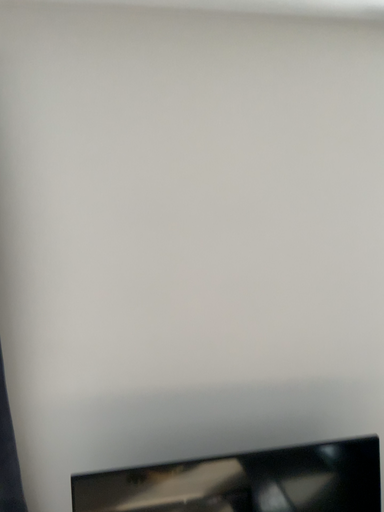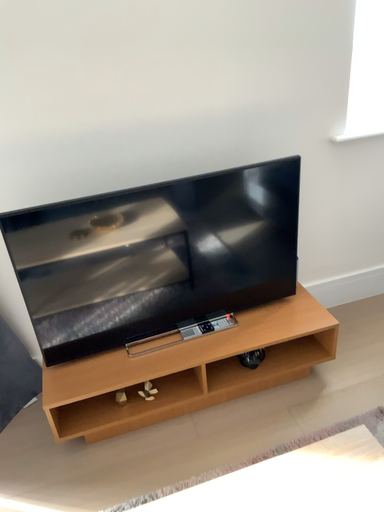
Question: Which way did the camera rotate in the video?

Choices:
 (A) rotated left
 (B) rotated right

Answer: (B)